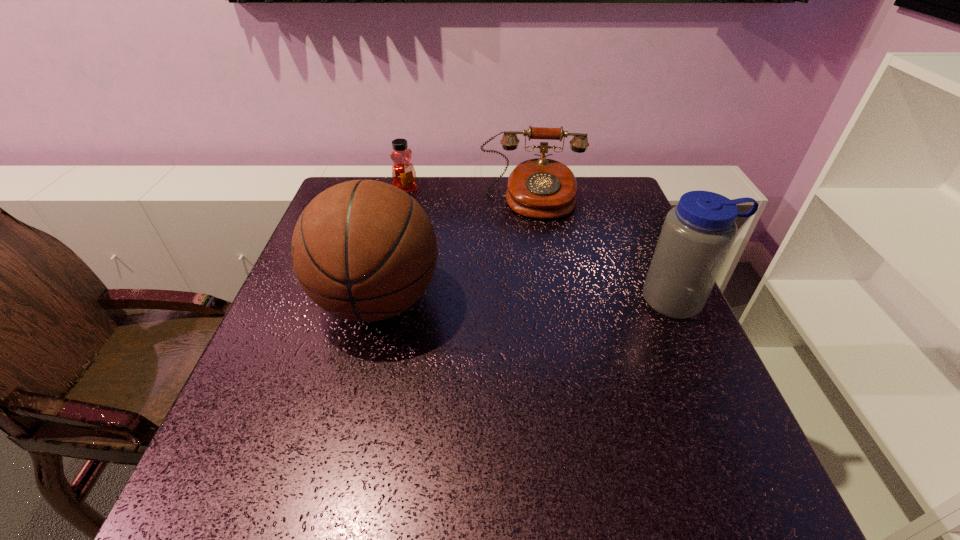
Image resolution: width=960 pixels, height=540 pixels. Find the location of `basketball`. basketball is located at coordinates (364, 250).

Identify the location of the rightmost object. (697, 235).

In order to click on the shortest object in this screenshot , I will do (x=403, y=173).

Identify the location of the third object from left to right. (541, 188).

Identify the location of telephone. This screenshot has width=960, height=540. (541, 188).

The image size is (960, 540). What are the coordinates of `vacant space located 0.180m with a carrying loop on the side of the rightmost object` in the screenshot? It's located at (722, 393).

The height and width of the screenshot is (540, 960). What are the coordinates of `vacant space located 0.110m on the front label of the shortest object` in the screenshot? It's located at (425, 213).

Find the location of a particular element. The image size is (960, 540). free spot located on the front label of the shortest object is located at coordinates [433, 221].

This screenshot has width=960, height=540. I want to click on vacant space situated 0.190m on the front label of the shortest object, so click(x=438, y=227).

At what (x,y) coordinates should I click in order to perform the action: click on vacant region located 0.150m on the dial of the telephone. Please return your answer as a coordinate pair (x, y). Looking at the image, I should click on (534, 254).